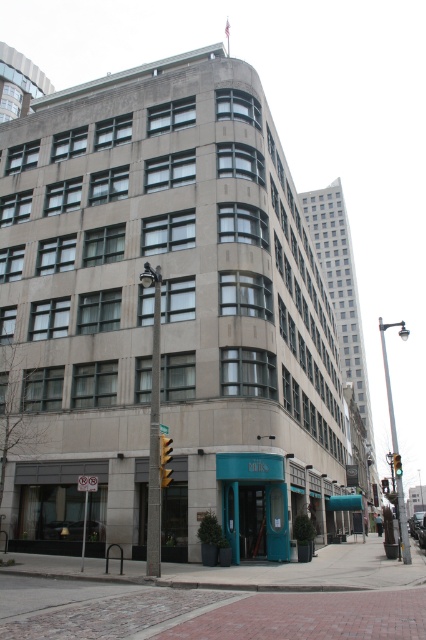
You are standing at the corner of the building and want to cross the street. There is a yellow plastic traffic light at lower center. Where is the yellow plastic traffic light located relative to your position?

The yellow plastic traffic light at lower center is located at point (164, 449), which means it is positioned to your right and slightly ahead of you.

You are a pedestrian standing at the intersection near the building. You see the yellow plastic traffic light at lower center and the green glass traffic light at upper right. Which traffic light is positioned more to the left side from your viewpoint?

The yellow plastic traffic light at lower center is positioned more to the left side from your viewpoint as it is to the left of the green glass traffic light at upper right.

You are a city planner reviewing the building facade. You notice the yellow plastic traffic light at lower center and the green glass traffic light at upper right. Which traffic light takes up more space on the building facade?

The green glass traffic light at upper right takes up more space on the building facade because the yellow plastic traffic light at lower center occupies less space than it.